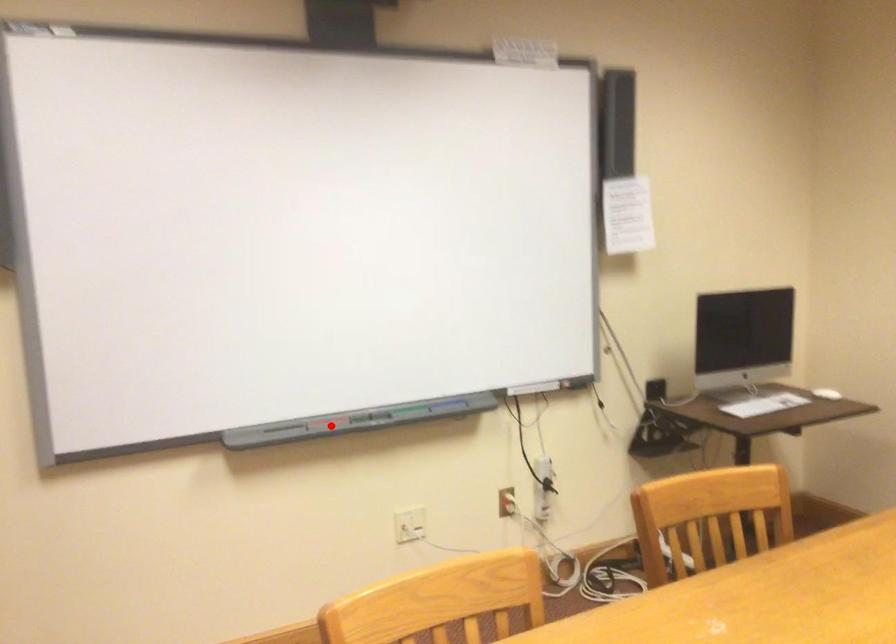
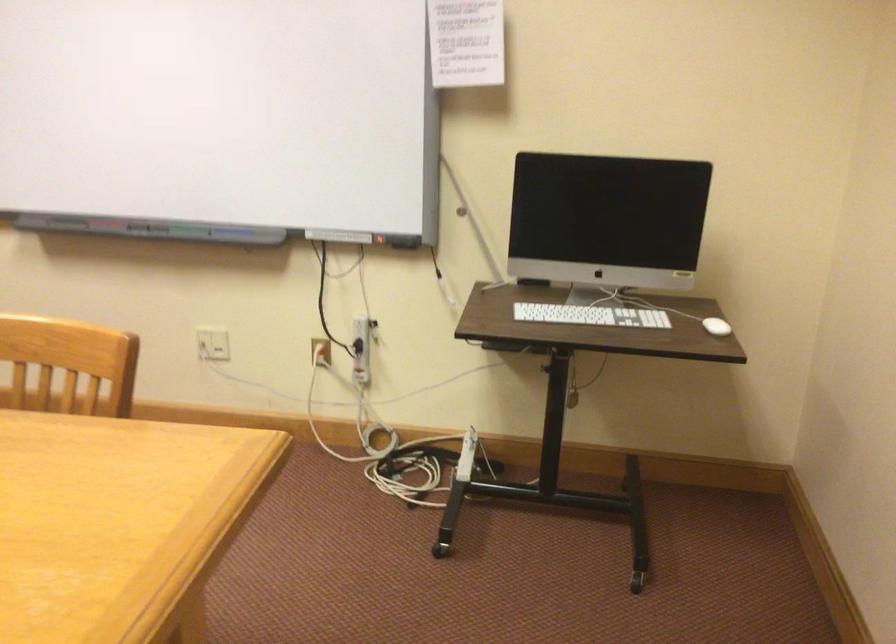
Locate, in the second image, the point that corresponds to the highlighted location in the first image.

(100, 225)